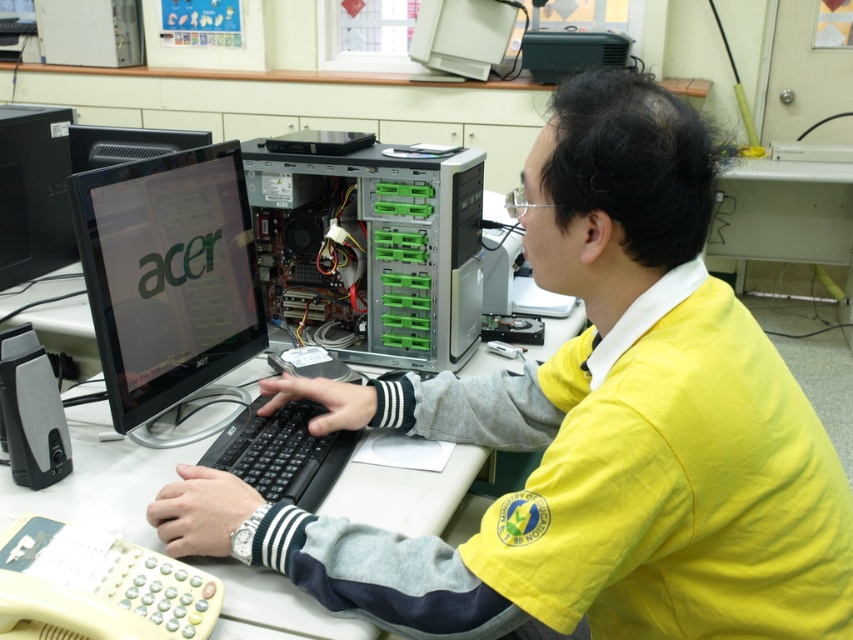
You are an office worker who needs to adjust the position of the yellow fabric shirt at center and the satin black monitor at center. According to the current setup, which object is located below the other?

The yellow fabric shirt at center is positioned under the satin black monitor at center, meaning the shirt is below the monitor.

You are organizing a small event and need to place a 12 inch by 12 inch square box on the white plastic table at center. Considering the size of the black plastic keyboard at center, will the box fit on the table without overlapping the keyboard?

The white plastic table at center is larger in size compared to the black plastic keyboard at center. Since the table is bigger, the 12x12 inch box should fit on the table without overlapping the keyboard as long as there is enough space around the keyboard.

You are a technician trying to access the keyboard behind the shirt. Is the black plastic keyboard at center reachable without moving the yellow fabric shirt at center?

The yellow fabric shirt at center is in front of the black plastic keyboard at center, so you cannot reach the keyboard without moving the shirt.